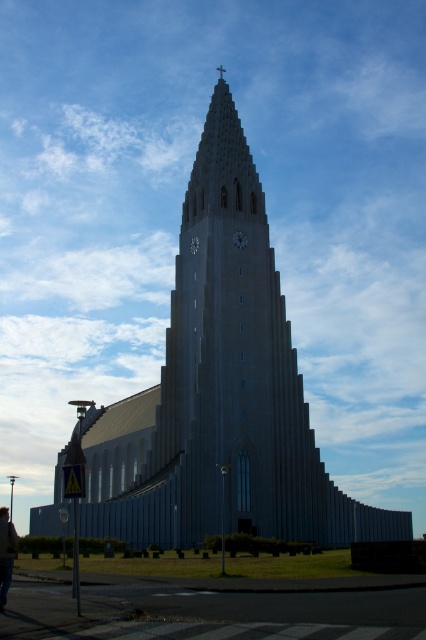
You are standing in front of the modernist church and see the dark gray jacket at lower left and the matte gray clock at center. Which object is closer to the ground?

The dark gray jacket at lower left is closer to the ground because it is positioned below the matte gray clock at center.